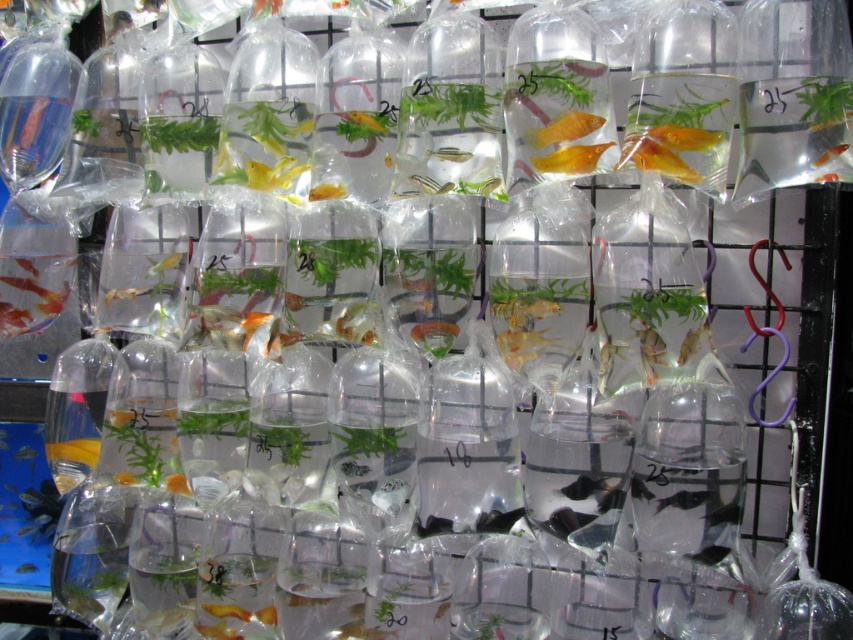
Question: Which of the following is the farthest from the observer?

Choices:
 (A) translucent plastic fish at center
 (B) translucent plastic goldfish at center

Answer: (A)

Question: Among these points, which one is farthest from the camera?

Choices:
 (A) (428, 188)
 (B) (444, 150)

Answer: (A)

Question: Does translucent plastic goldfish at center have a greater width compared to translucent plastic fish at center?

Choices:
 (A) no
 (B) yes

Answer: (B)

Question: Which of the following is the farthest from the observer?

Choices:
 (A) translucent plastic fish at center
 (B) translucent plastic goldfish at center

Answer: (A)

Question: In this image, where is translucent plastic goldfish at center located relative to translucent plastic fish at center?

Choices:
 (A) above
 (B) below

Answer: (A)

Question: Does translucent plastic goldfish at center come behind translucent plastic fish at center?

Choices:
 (A) no
 (B) yes

Answer: (A)